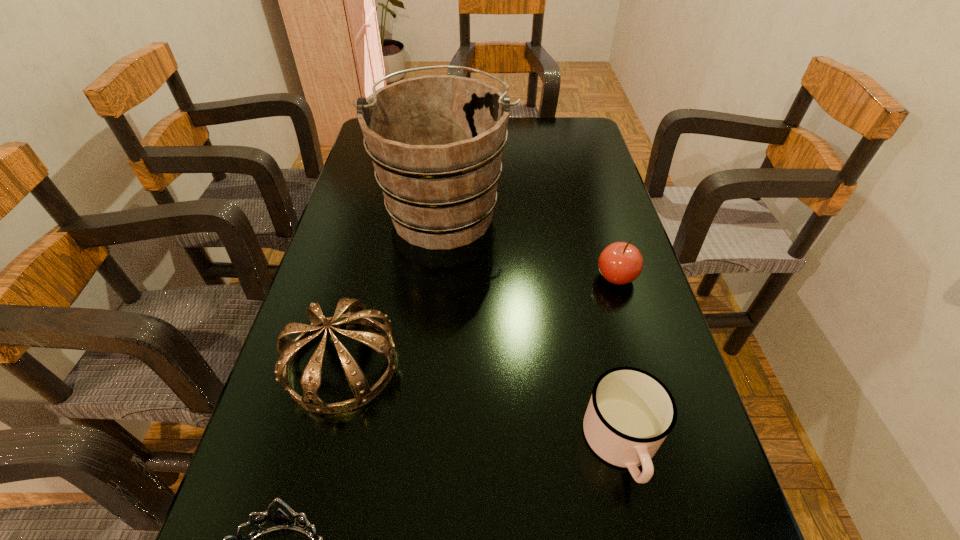
The width and height of the screenshot is (960, 540). I want to click on the farthest object, so click(x=436, y=142).

You are a GUI agent. You are given a task and a screenshot of the screen. Output one action in this format:
    pyautogui.click(x=<x>, y=<y>)
    Task: Click on the tallest object
    Image resolution: width=960 pixels, height=540 pixels.
    Given the screenshot: What is the action you would take?
    pyautogui.click(x=436, y=142)

Where is `the taller tiara`? Image resolution: width=960 pixels, height=540 pixels. the taller tiara is located at coordinates (358, 313).

Locate an element on the screen. The width and height of the screenshot is (960, 540). the farther tiara is located at coordinates (358, 313).

You are a GUI agent. You are given a task and a screenshot of the screen. Output one action in this format:
    pyautogui.click(x=<x>, y=<y>)
    Task: Click on the fourth nearest object
    
    Given the screenshot: What is the action you would take?
    pyautogui.click(x=620, y=263)

Identify the location of mug. This screenshot has height=540, width=960. (630, 413).

At what (x,y) coordinates should I click in order to perform the action: click on free spot located on the handle side of the tallest object. Please return your answer as a coordinate pair (x, y). The height and width of the screenshot is (540, 960). Looking at the image, I should click on (451, 145).

Identify the location of free region located 0.130m on the handle side of the tallest object. click(x=450, y=150).

The width and height of the screenshot is (960, 540). What are the coordinates of `vacant space located on the handle side of the tallest object` in the screenshot? It's located at (450, 154).

You are a GUI agent. You are given a task and a screenshot of the screen. Output one action in this format:
    pyautogui.click(x=<x>, y=<y>)
    Task: Click on the vacant space situated on the back of the farther tiara
    This screenshot has height=540, width=960.
    Given the screenshot: What is the action you would take?
    pyautogui.click(x=382, y=207)